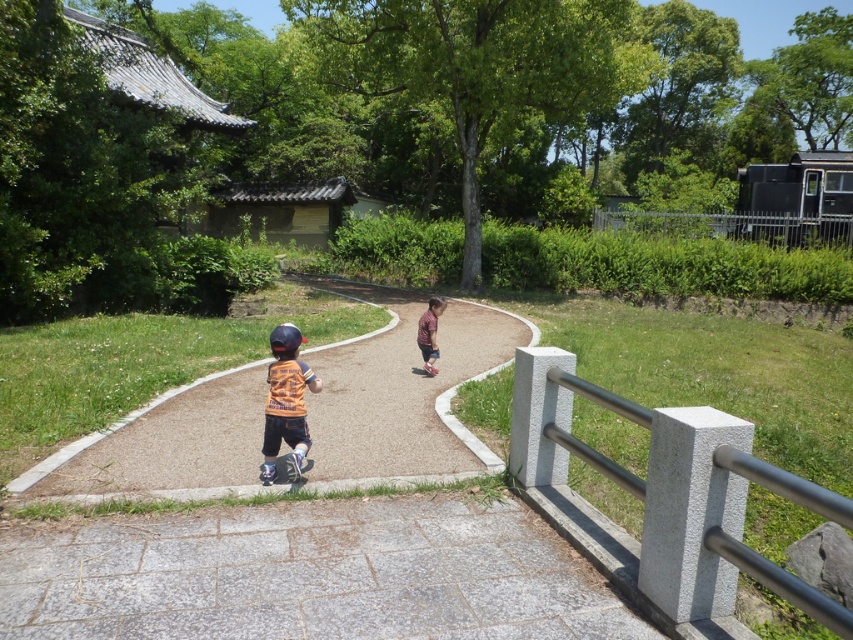
Consider the image. Between gray concrete rail at right and metallic fence at upper right, which one has more height?

metallic fence at upper right is taller.

Is gray concrete rail at right below metallic fence at upper right?

Yes, gray concrete rail at right is below metallic fence at upper right.

Which is in front, point (726, 444) or point (704, 224)?

Point (726, 444) is more forward.

Find the location of `gray concrete rail at right`. gray concrete rail at right is located at coordinates (780, 580).

In the scene shown: Between brown asphalt path at center and matte black helmet at center, which one appears on the left side from the viewer's perspective?

From the viewer's perspective, matte black helmet at center appears more on the left side.

Which of these two, brown asphalt path at center or matte black helmet at center, stands taller?

Standing taller between the two is brown asphalt path at center.

Does point (389, 368) lie in front of point (283, 323)?

Yes, point (389, 368) is in front of point (283, 323).

This screenshot has height=640, width=853. What are the coordinates of `brown asphalt path at center` in the screenshot? It's located at (402, 394).

Does point (299, 429) come closer to viewer compared to point (425, 314)?

Yes.

Between orange jersey at center and plaid shirt at center, which one has more height?

Standing taller between the two is orange jersey at center.

Measure the distance between orange jersey at center and camera.

A distance of 14.31 feet exists between orange jersey at center and camera.

Find the location of a particular element. orange jersey at center is located at coordinates (286, 404).